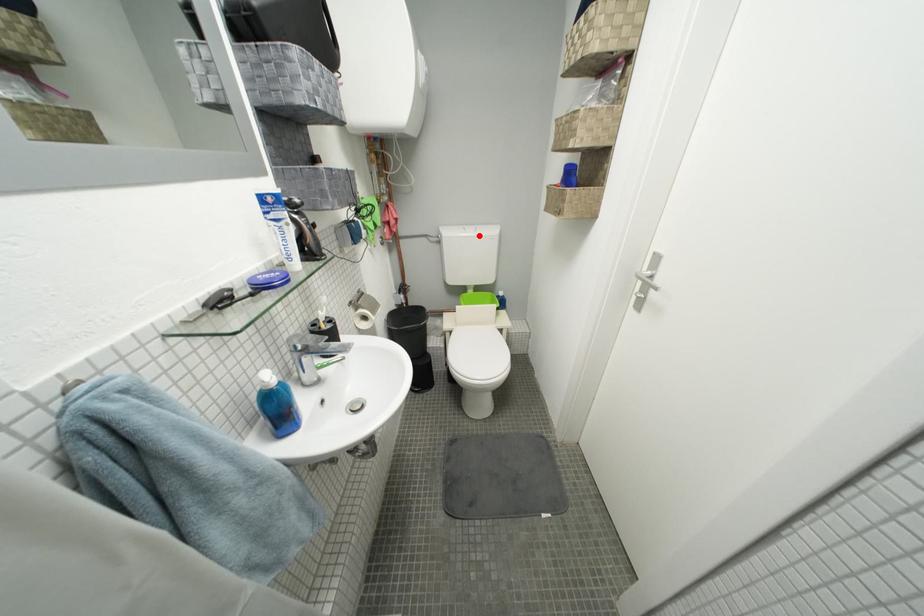
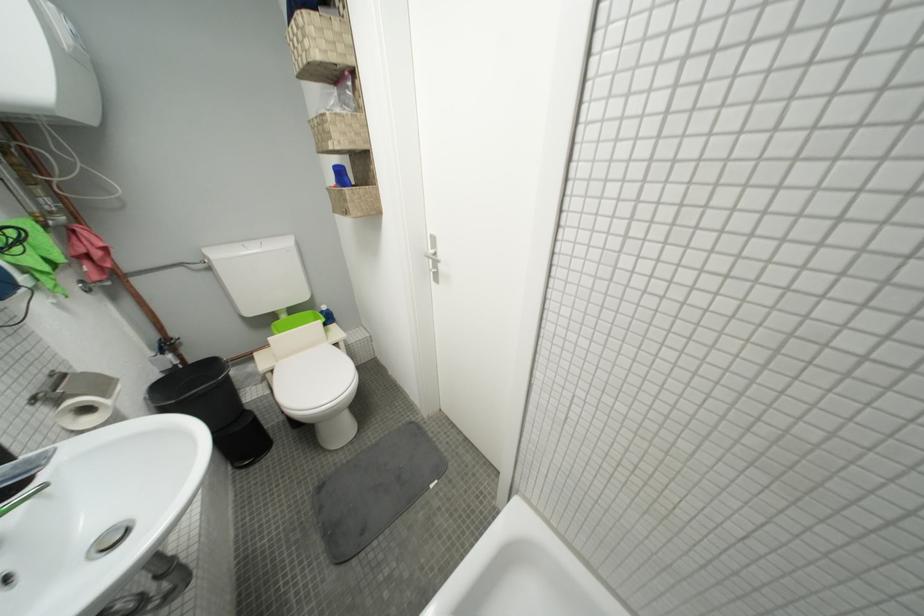
Where in the second image is the point corresponding to the highlighted location from the first image?

(262, 252)